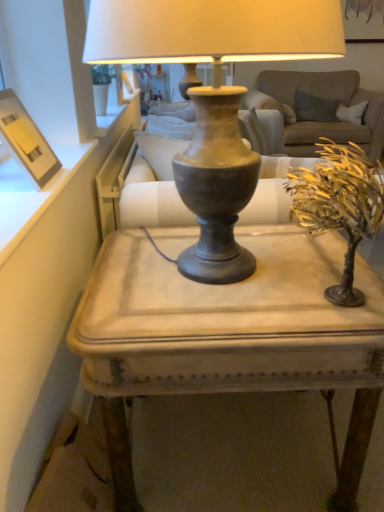
Locate an element on the screen. The height and width of the screenshot is (512, 384). space that is in front of matte wood picture frame at upper left is located at coordinates (24, 205).